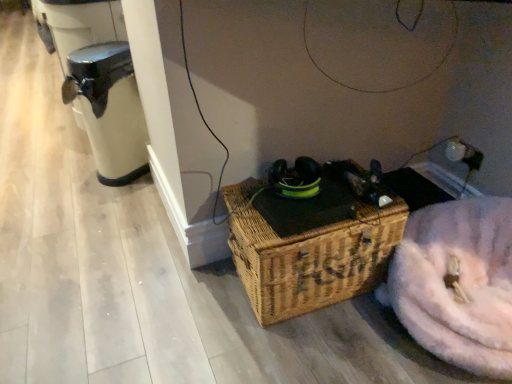
You are a GUI agent. You are given a task and a screenshot of the screen. Output one action in this format:
    pyautogui.click(x=<x>, y=<y>)
    Task: Click on the free location to the left of black plastic water heater at left
    
    Given the screenshot: What is the action you would take?
    pyautogui.click(x=73, y=172)